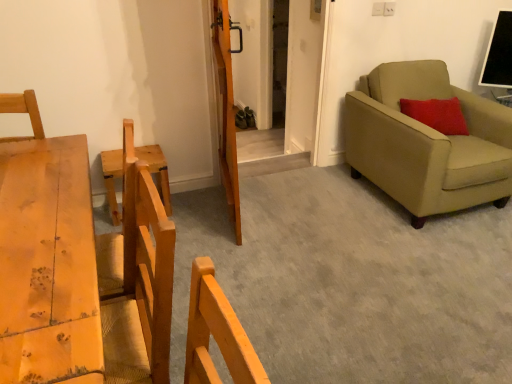
Question: From the image's perspective, is wooden chair at left located above or below light brown wooden table at left?

Choices:
 (A) below
 (B) above

Answer: (B)

Question: In the image, is wooden chair at left on the left side or the right side of light brown wooden table at left?

Choices:
 (A) right
 (B) left

Answer: (B)

Question: Which of these objects is positioned closest to the beige fabric armchair at right?

Choices:
 (A) wooden barn door at center
 (B) wooden chair at left
 (C) wooden door at center
 (D) light brown wooden table at left

Answer: (A)

Question: Estimate the real-world distances between objects in this image. Which object is farther from the beige fabric armchair at right?

Choices:
 (A) wooden barn door at center
 (B) wooden door at center
 (C) wooden chair at left
 (D) light brown wooden table at left

Answer: (D)